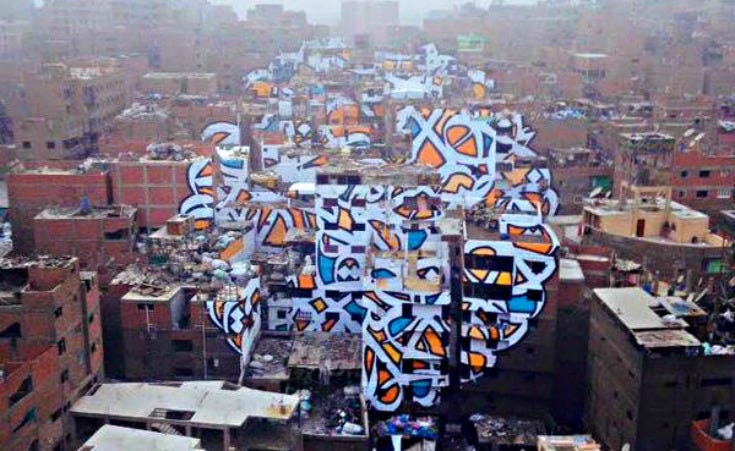
The width and height of the screenshot is (735, 451). Find the location of `geometric artwork`. geometric artwork is located at coordinates (467, 147).